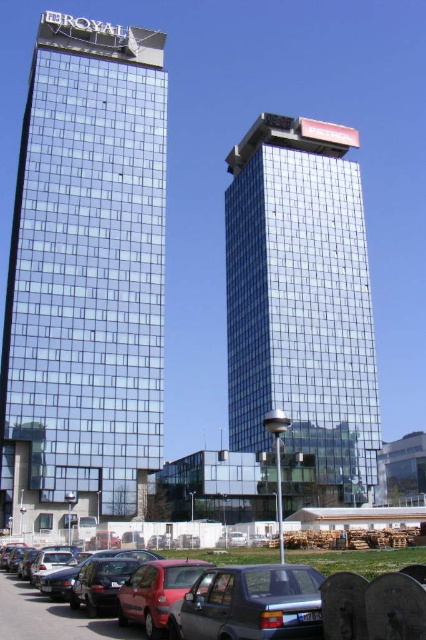
Question: Can you confirm if shiny glass tower at center is smaller than metallic silver car at lower center?

Choices:
 (A) yes
 (B) no

Answer: (B)

Question: Estimate the real-world distances between objects in this image. Which object is farther from the metallic silver car at lower center?

Choices:
 (A) shiny glass tower at center
 (B) shiny glass building at left
 (C) metallic silver sedan at lower center
 (D) red matte car at lower left

Answer: (A)

Question: Which point is closer to the camera taking this photo?

Choices:
 (A) (164, 99)
 (B) (192, 637)
 (C) (150, 621)

Answer: (B)

Question: Based on their relative distances, which object is farther from the shiny glass building at left?

Choices:
 (A) shiny glass tower at center
 (B) metallic silver sedan at lower center
 (C) metallic silver car at lower center
 (D) red matte car at lower left

Answer: (B)

Question: Can you confirm if metallic silver sedan at lower center is thinner than red matte car at lower left?

Choices:
 (A) no
 (B) yes

Answer: (A)

Question: Is metallic silver car at lower center above red matte car at lower left?

Choices:
 (A) no
 (B) yes

Answer: (A)